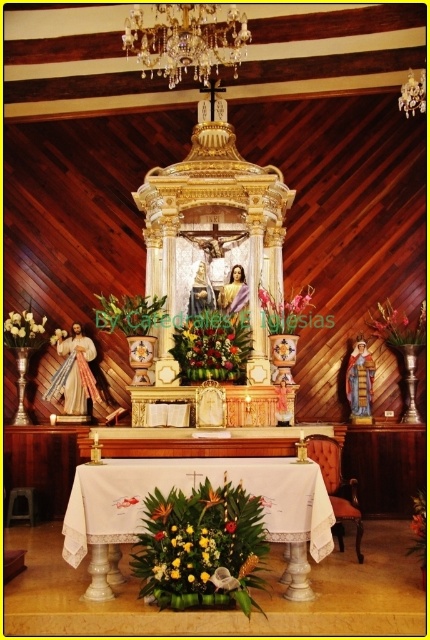
You are a church caretaker who needs to replace the floral arrangements. You have a new arrangement that is 1 meter wide. The existing green leafy plant at center and yellow matte flower at center are both at the center. Can you determine which existing arrangement is wider to ensure proper placement?

The green leafy plant at center might be wider than yellow matte flower at center, so you should check its width before placing the new arrangement.

You are standing in the church and want to place a candle on the table in front of the altar. The table is at point (200, 547). Where should you place the candle so it doesn not block the vibrant floral bouquet at center?

The vibrant floral bouquet at center is located at point (200, 547), so you should place the candle somewhere else on the table away from that point to avoid blocking it.

You are an altar decorator who needs to adjust the arrangement. You see the vibrant floral bouquet at center and the yellow fabric flower at center. Which one is positioned higher?

The vibrant floral bouquet at center is positioned higher than the yellow fabric flower at center.